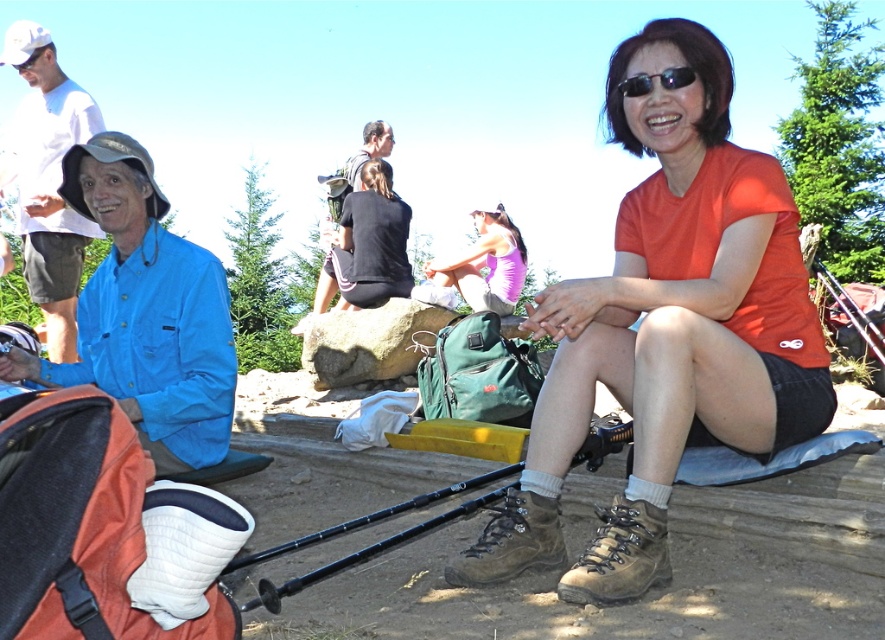
Who is more forward, [550,557] or [129,320]?

Point [550,557]

Is point (528, 516) more distant than point (116, 200)?

No.

The width and height of the screenshot is (885, 640). Identify the location of orange matte shirt at center. (666, 324).

The height and width of the screenshot is (640, 885). In order to click on orange matte shirt at center in this screenshot , I will do `click(666, 324)`.

Is black plastic pole at lower center to the right of dark gray backpack at center from the viewer's perspective?

Indeed, black plastic pole at lower center is positioned on the right side of dark gray backpack at center.

Is the position of black plastic pole at lower center less distant than that of dark gray backpack at center?

Yes.

Between point (329, 570) and point (318, 284), which one is positioned in front?

Point (329, 570) is more forward.

This screenshot has height=640, width=885. I want to click on black plastic pole at lower center, so [366, 552].

Which is more to the left, blue fabric jacket at upper left or brown leather hiking boot at lower center?

Positioned to the left is blue fabric jacket at upper left.

Where is `blue fabric jacket at upper left`? The image size is (885, 640). blue fabric jacket at upper left is located at coordinates (48, 180).

Where is `blue fabric jacket at upper left`? blue fabric jacket at upper left is located at coordinates (48, 180).